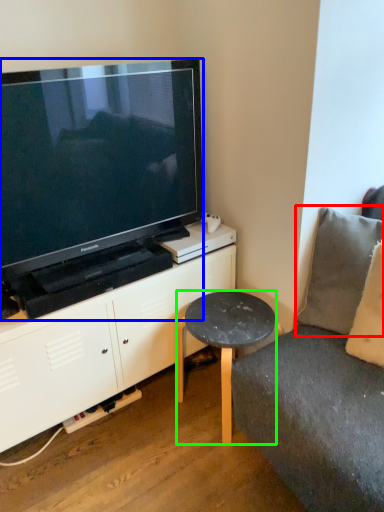
Question: Considering the real-world distances, which object is closest to pillow (highlighted by a red box)? television (highlighted by a blue box) or table (highlighted by a green box).

Choices:
 (A) television
 (B) table

Answer: (B)